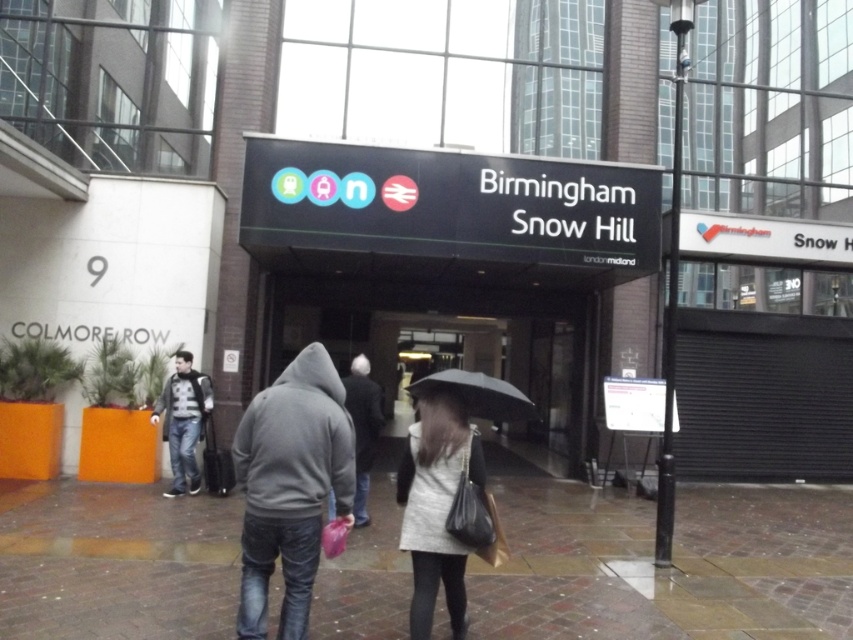
Is brick pavement at lower center further to camera compared to gray hoodie at center?

Yes, it is.

Between brick pavement at lower center and gray hoodie at center, which one has less height?

brick pavement at lower center is shorter.

At what (x,y) coordinates should I click in order to perform the action: click on brick pavement at lower center. Please return your answer as a coordinate pair (x, y). Image resolution: width=853 pixels, height=640 pixels. Looking at the image, I should click on (672, 561).

I want to click on brick pavement at lower center, so [672, 561].

Who is more forward, (196, 509) or (440, 372)?

Point (196, 509)

Is brick pavement at lower center positioned behind black matte umbrella at center?

Yes, it is behind black matte umbrella at center.

Which is behind, point (368, 540) or point (422, 385)?

Positioned behind is point (368, 540).

What are the coordinates of `brick pavement at lower center` in the screenshot? It's located at (672, 561).

Is gray hoodie at center thinner than denim jacket at center?

In fact, gray hoodie at center might be wider than denim jacket at center.

Measure the distance between gray hoodie at center and denim jacket at center.

A distance of 4.98 meters exists between gray hoodie at center and denim jacket at center.

Is point (239, 630) more distant than point (152, 413)?

No, it is in front of (152, 413).

I want to click on gray hoodie at center, so click(289, 486).